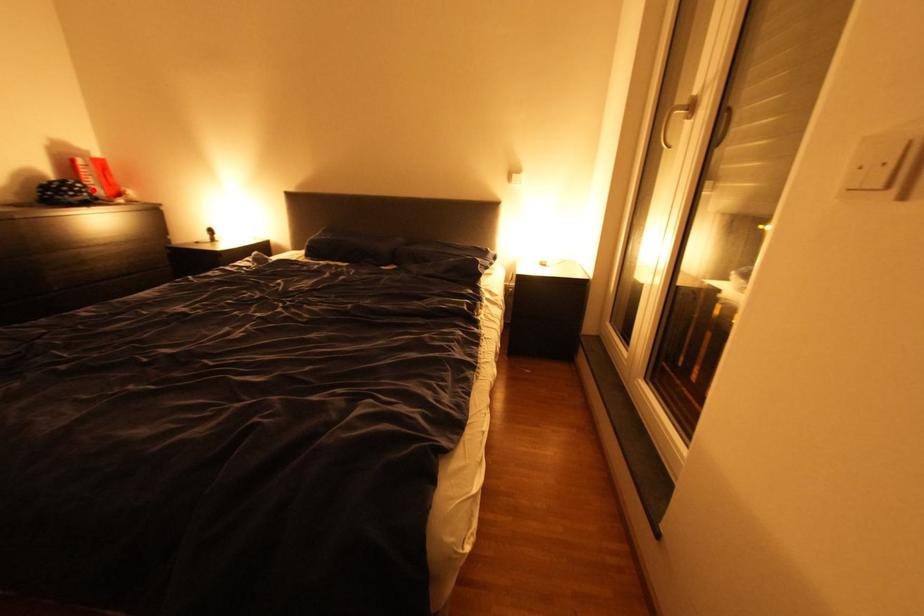
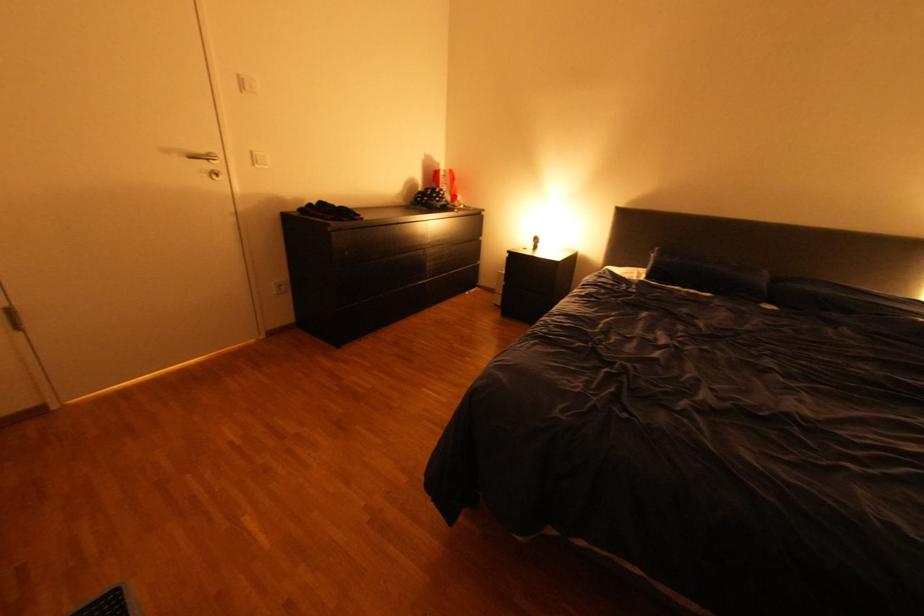
I am providing you with two images of the same scene from different viewpoints. A red point is marked on the first image and another point is marked on the second image. Is the red point in image1 aligned with the point shown in image2?

Yes